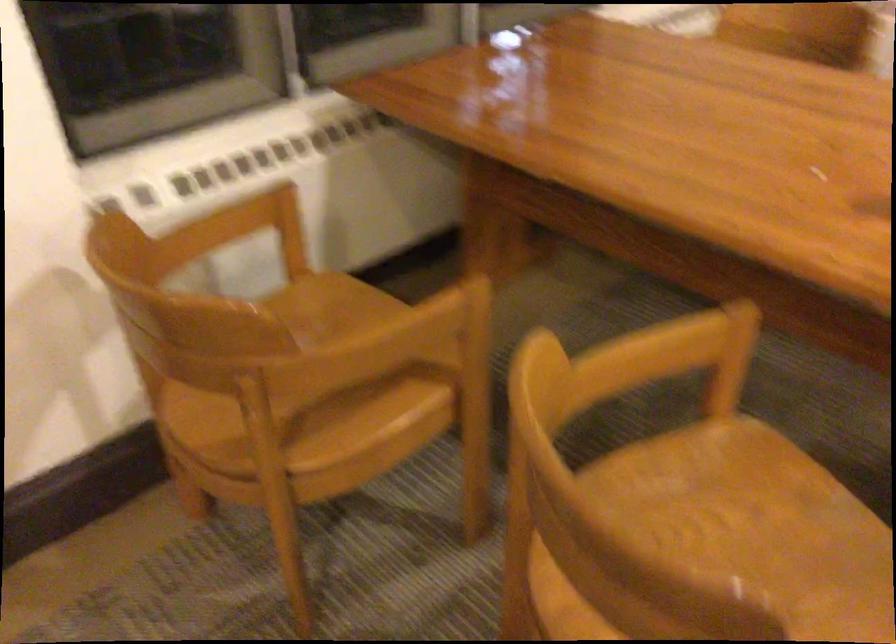
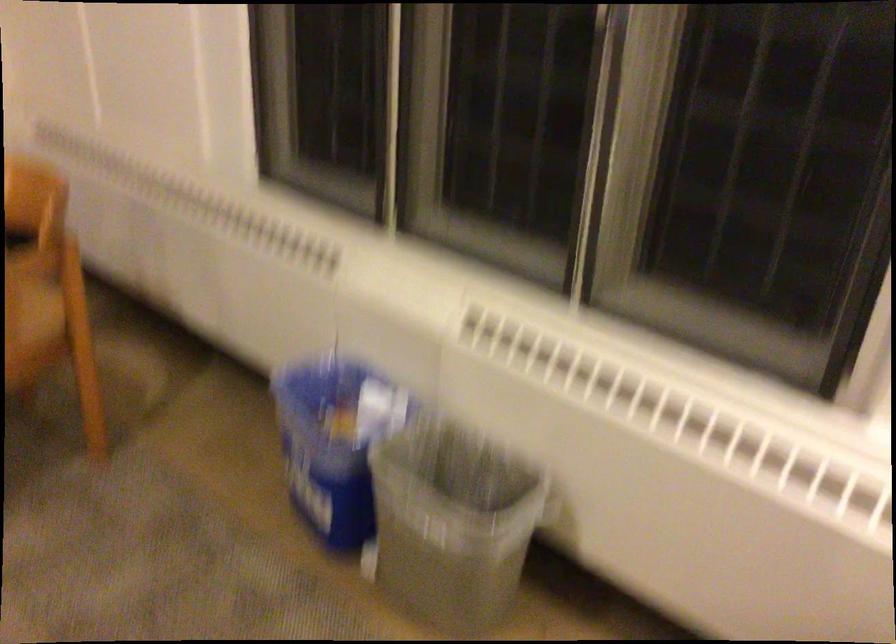
Question: What movement of the cameraman would produce the second image?

Choices:
 (A) Left
 (B) Right
 (C) Forward
 (D) Backward

Answer: (B)